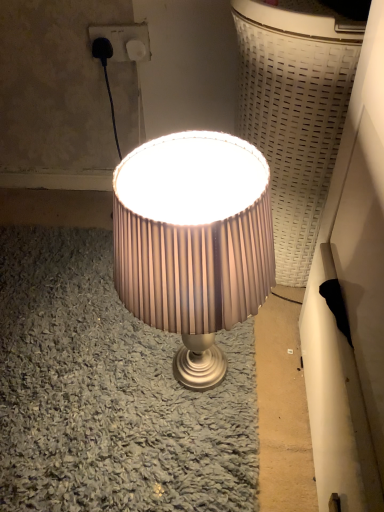
Question: From the image's perspective, is matte beige lampshade at center above or below white plastic socket at upper center?

Choices:
 (A) below
 (B) above

Answer: (A)

Question: Visually, is matte beige lampshade at center positioned to the left or to the right of white plastic socket at upper center?

Choices:
 (A) left
 (B) right

Answer: (B)

Question: From a real-world perspective, is matte beige lampshade at center positioned above or below white plastic socket at upper center?

Choices:
 (A) below
 (B) above

Answer: (A)

Question: In the image, is white plastic socket at upper center on the left side or the right side of matte beige lampshade at center?

Choices:
 (A) left
 (B) right

Answer: (A)

Question: Considering the positions of white plastic socket at upper center and matte beige lampshade at center in the image, is white plastic socket at upper center bigger or smaller than matte beige lampshade at center?

Choices:
 (A) big
 (B) small

Answer: (B)

Question: Is point (92, 31) closer or farther from the camera than point (125, 194)?

Choices:
 (A) farther
 (B) closer

Answer: (A)

Question: Choose the correct answer: Is white plastic socket at upper center inside matte beige lampshade at center or outside it?

Choices:
 (A) inside
 (B) outside

Answer: (B)